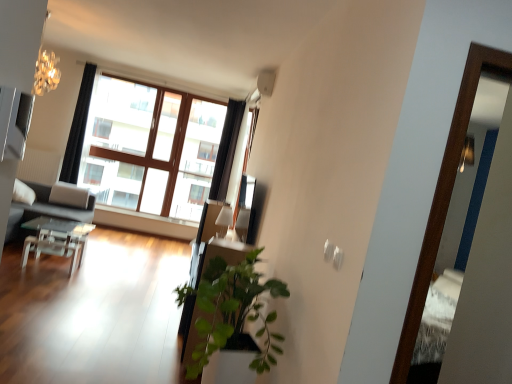
Question: From the image's perspective, is transparent glass table at lower left above black fabric curtain at upper left, the 2th curtain positioned from the right?

Choices:
 (A) no
 (B) yes

Answer: (A)

Question: Would you say black fabric curtain at upper left, which appears as the 1th curtain when viewed from the left, is part of transparent glass table at lower left's contents?

Choices:
 (A) yes
 (B) no

Answer: (B)

Question: From the image's perspective, is transparent glass table at lower left located beneath black fabric curtain at upper left, which appears as the 1th curtain when viewed from the left?

Choices:
 (A) no
 (B) yes

Answer: (B)

Question: Is transparent glass table at lower left taller than black fabric curtain at upper left, which appears as the 1th curtain when viewed from the left?

Choices:
 (A) no
 (B) yes

Answer: (A)

Question: Is transparent glass table at lower left facing towards black fabric curtain at upper left, the 2th curtain positioned from the right?

Choices:
 (A) no
 (B) yes

Answer: (A)

Question: Considering the relative sizes of transparent glass table at lower left and black fabric curtain at upper left, which appears as the 1th curtain when viewed from the left, in the image provided, is transparent glass table at lower left shorter than black fabric curtain at upper left, which appears as the 1th curtain when viewed from the left,?

Choices:
 (A) no
 (B) yes

Answer: (B)

Question: Is black fabric curtain at upper left, which appears as the 1th curtain when viewed from the left, closer to camera compared to wooden window at center?

Choices:
 (A) no
 (B) yes

Answer: (B)

Question: Does black fabric curtain at upper left, the 2th curtain positioned from the right, have a larger size compared to wooden window at center?

Choices:
 (A) no
 (B) yes

Answer: (A)

Question: Does black fabric curtain at upper left, which appears as the 1th curtain when viewed from the left, come behind wooden window at center?

Choices:
 (A) yes
 (B) no

Answer: (B)

Question: Is black fabric curtain at upper left, the 2th curtain positioned from the right, directly adjacent to wooden window at center?

Choices:
 (A) no
 (B) yes

Answer: (A)

Question: Does black fabric curtain at upper left, which appears as the 1th curtain when viewed from the left, have a greater width compared to wooden window at center?

Choices:
 (A) no
 (B) yes

Answer: (B)

Question: From a real-world perspective, does black fabric curtain at upper left, which appears as the 1th curtain when viewed from the left, stand above wooden window at center?

Choices:
 (A) no
 (B) yes

Answer: (B)

Question: From the image's perspective, is transparent glass table at lower left located above wooden screen door at right?

Choices:
 (A) no
 (B) yes

Answer: (A)